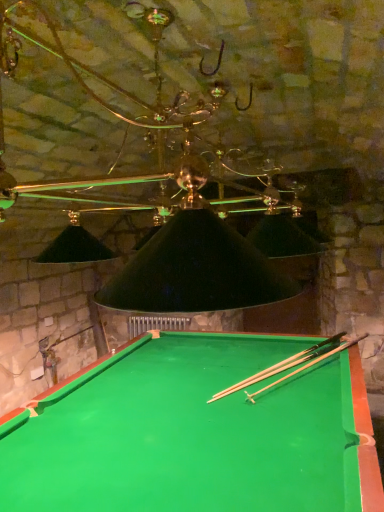
Where is `vacant region above wooden cue at center (from a real-world perspective)`? The height and width of the screenshot is (512, 384). vacant region above wooden cue at center (from a real-world perspective) is located at coordinates (293, 361).